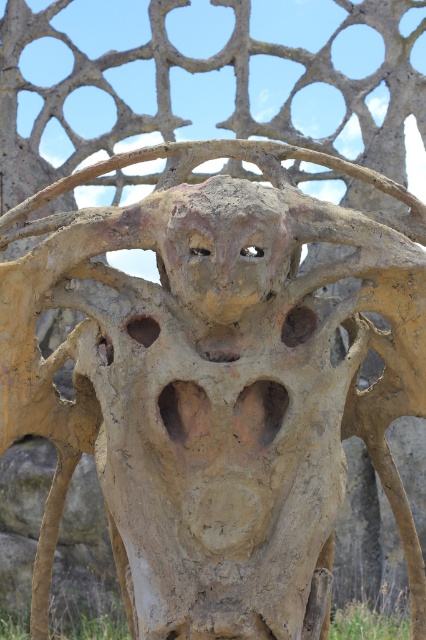
Question: Among these objects, which one is nearest to the camera?

Choices:
 (A) green grass at lower center
 (B) rusty clay face at center

Answer: (B)

Question: Is rusty clay face at center wider than green grass at lower center?

Choices:
 (A) no
 (B) yes

Answer: (A)

Question: Which point is closer to the camera?

Choices:
 (A) rusty clay face at center
 (B) green grass at lower center

Answer: (A)

Question: Is rusty clay face at center above green grass at lower center?

Choices:
 (A) no
 (B) yes

Answer: (B)

Question: Is rusty clay face at center wider than green grass at lower center?

Choices:
 (A) yes
 (B) no

Answer: (B)